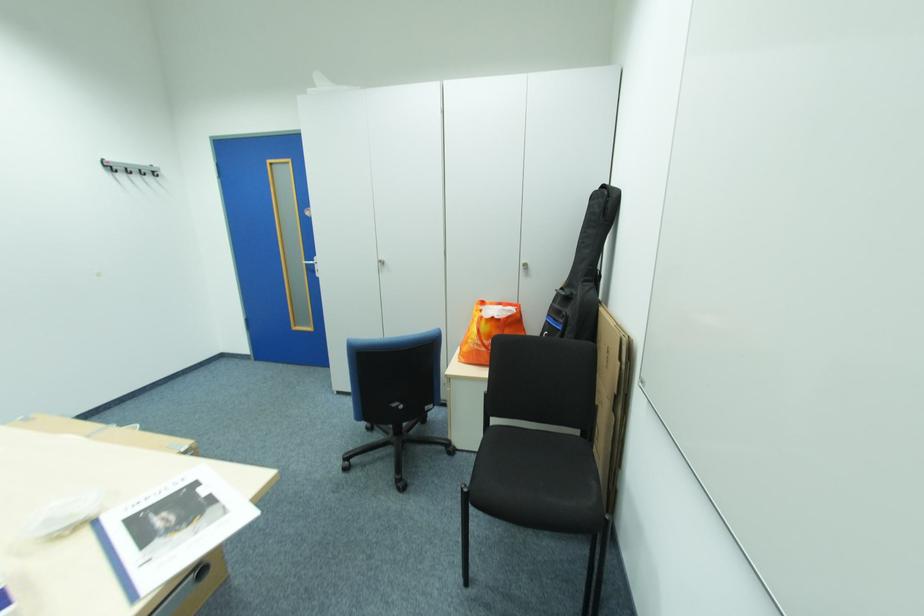
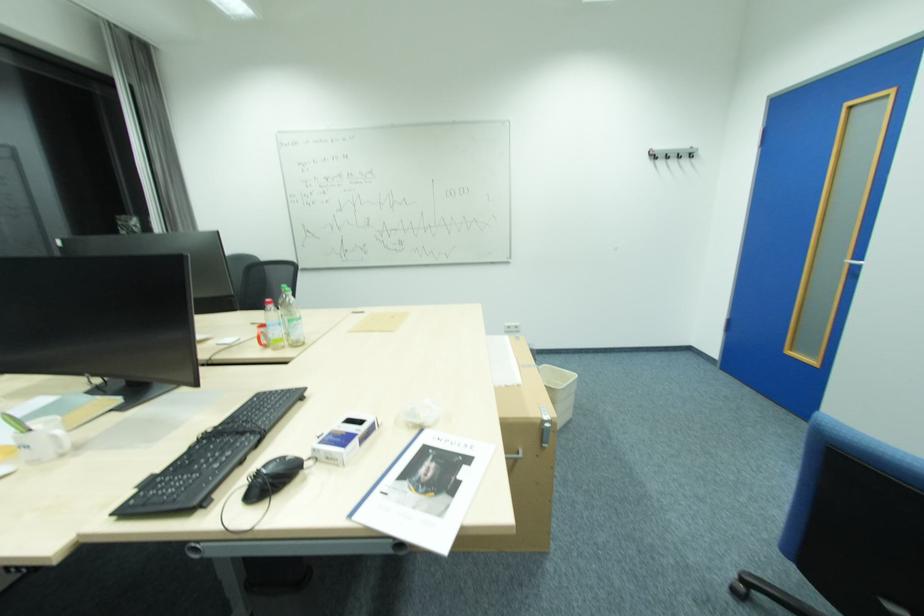
Question: How did the camera likely rotate?

Choices:
 (A) Left
 (B) Right
 (C) Up
 (D) Down

Answer: (A)